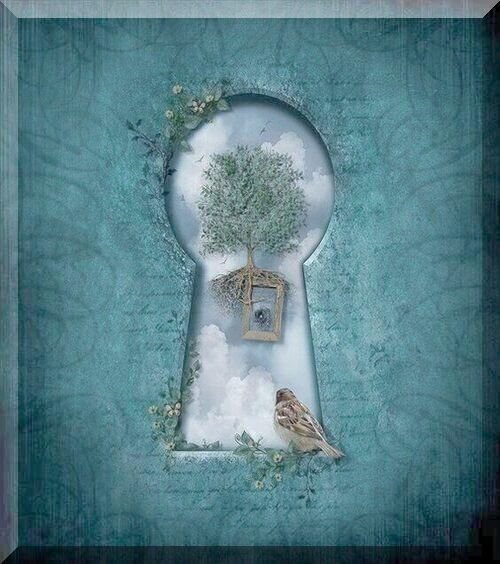
This screenshot has width=500, height=564. In order to click on picture frame in picture in this screenshot , I will do `click(276, 311)`.